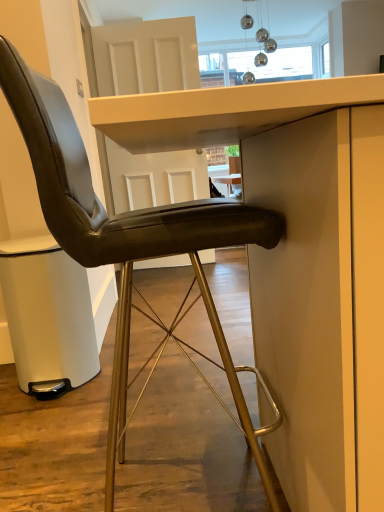
What do you see at coordinates (224, 111) in the screenshot? The image size is (384, 512). I see `matte white table at center` at bounding box center [224, 111].

Based on the photo, measure the distance between point (153, 116) and camera.

Point (153, 116) is 53.50 centimeters from camera.

Find the location of a particular element. This screenshot has height=512, width=384. matte white table at center is located at coordinates pos(224,111).

Where is `black leather chair at center`? The width and height of the screenshot is (384, 512). black leather chair at center is located at coordinates (129, 240).

Describe the element at coordinates (129, 240) in the screenshot. I see `black leather chair at center` at that location.

Image resolution: width=384 pixels, height=512 pixels. Identify the location of matte white table at center. (224, 111).

Is black leather chair at center to the left or to the right of matte white table at center in the image?

black leather chair at center is positioned on matte white table at center's left side.

Is black leather chair at center in front of or behind matte white table at center in the image?

In the image, black leather chair at center appears behind matte white table at center.

Which is less distant, (123, 368) or (345, 387)?

Point (345, 387)

From the image's perspective, is black leather chair at center above or below matte white table at center?

From the image's perspective, black leather chair at center appears above matte white table at center.

From a real-world perspective, which is physically above, black leather chair at center or matte white table at center?

In real-world perspective, black leather chair at center is above.

Can you confirm if black leather chair at center is wider than matte white table at center?

In fact, black leather chair at center might be narrower than matte white table at center.

Can you confirm if black leather chair at center is taller than matte white table at center?

Yes.

Who is smaller, black leather chair at center or matte white table at center?

With smaller size is black leather chair at center.

Would you say black leather chair at center is outside matte white table at center?

No, most part of black leather chair at center lies within matte white table at center.

Consider the image. Is black leather chair at center beside matte white table at center?

black leather chair at center and matte white table at center are not in contact.

Is matte white table at center at the back of black leather chair at center?

That's right, black leather chair at center is facing away from matte white table at center.

How many degrees apart are the facing directions of black leather chair at center and matte white table at center?

They differ by 88.3 degrees in their facing directions.

Where is `table in front of the black leather chair at center`? table in front of the black leather chair at center is located at coordinates (224, 111).

Can you confirm if matte white table at center is positioned to the right of black leather chair at center?

Correct, you'll find matte white table at center to the right of black leather chair at center.

Looking at this image, is the position of matte white table at center less distant than that of black leather chair at center?

Yes.

Considering the positions of point (260, 119) and point (166, 206), is point (260, 119) closer or farther from the camera than point (166, 206)?

Point (260, 119) is positioned closer to the camera compared to point (166, 206).

From the image's perspective, is matte white table at center above black leather chair at center?

No, from the image's perspective, matte white table at center is not on top of black leather chair at center.

From a real-world perspective, which object stands above the other?

From a 3D spatial view, black leather chair at center is above.

From the picture: Does matte white table at center have a greater width compared to black leather chair at center?

Yes.

Who is taller, matte white table at center or black leather chair at center?

black leather chair at center.

Does matte white table at center have a larger size compared to black leather chair at center?

Yes, matte white table at center is bigger than black leather chair at center.

Is matte white table at center positioned beyond the bounds of black leather chair at center?

matte white table at center is positioned outside black leather chair at center.

Are matte white table at center and black leather chair at center located far from each other?

No, there isn't a large distance between matte white table at center and black leather chair at center.

Is matte white table at center oriented towards black leather chair at center?

No, matte white table at center is not facing towards black leather chair at center.

Can you tell me how much matte white table at center and black leather chair at center differ in facing direction?

There is a 88.3-degree angle between the facing directions of matte white table at center and black leather chair at center.

Locate an element on the screen. table below the black leather chair at center (from a real-world perspective) is located at coordinates (224, 111).

The height and width of the screenshot is (512, 384). In order to click on table to the right of black leather chair at center in this screenshot , I will do `click(224, 111)`.

Where is `chair that appears above the matte white table at center (from the image's perspective)`? chair that appears above the matte white table at center (from the image's perspective) is located at coordinates (129, 240).